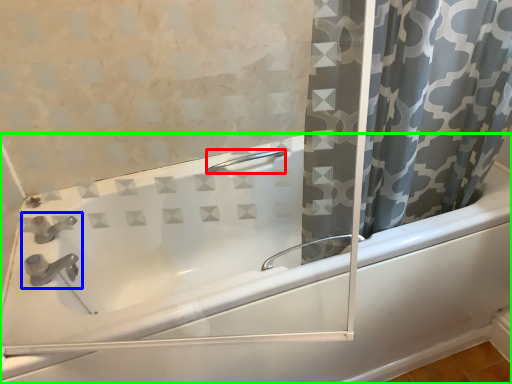
Question: Estimate the real-world distances between objects in this image. Which object is closer to shower (highlighted by a red box), sink (highlighted by a blue box) or bathtub (highlighted by a green box)?

Choices:
 (A) sink
 (B) bathtub

Answer: (B)